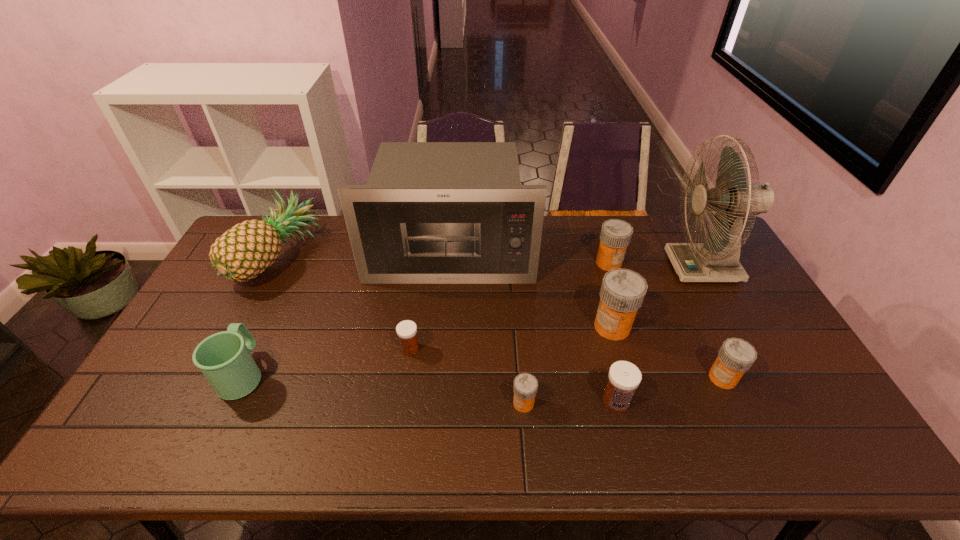
Image resolution: width=960 pixels, height=540 pixels. In order to click on vacant space located 0.270m on the label side of the second smallest orange medicine in this screenshot , I will do `click(608, 378)`.

At what (x,y) coordinates should I click in order to perform the action: click on free point located on the label side of the second smallest orange medicine. Please return your answer as a coordinate pair (x, y). Looking at the image, I should click on (675, 378).

Find the location of a particular element. The height and width of the screenshot is (540, 960). vacant point located on the label side of the second smallest orange medicine is located at coordinates (683, 378).

Where is `free space located on the left of the nearer white medicine`? free space located on the left of the nearer white medicine is located at coordinates (535, 401).

Locate an element on the screen. The height and width of the screenshot is (540, 960). vacant region located on the back of the farther white medicine is located at coordinates (421, 267).

The image size is (960, 540). I want to click on free space located on the label side of the smallest orange medicine, so click(387, 403).

At what (x,y) coordinates should I click in order to perform the action: click on blank space located 0.400m on the label side of the smallest orange medicine. Please return your answer as a coordinate pair (x, y). This screenshot has width=960, height=540. Looking at the image, I should click on (355, 403).

Where is `free spot located on the label side of the smallest orange medicine`? This screenshot has width=960, height=540. free spot located on the label side of the smallest orange medicine is located at coordinates point(387,403).

At what (x,y) coordinates should I click in order to perform the action: click on fan situated at the far edge. Please return your answer as a coordinate pair (x, y). Looking at the image, I should click on (717, 259).

Locate an element on the screen. Image resolution: width=960 pixels, height=540 pixels. microwave oven that is at the far edge is located at coordinates (431, 212).